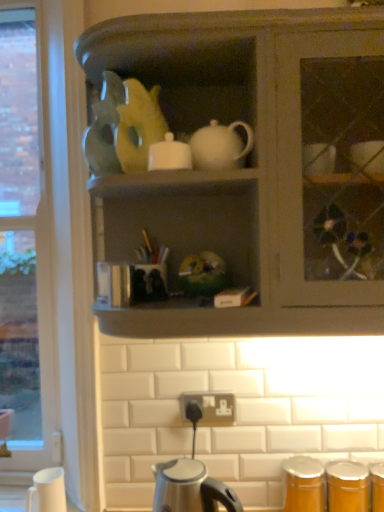
Question: Can you confirm if white glossy sugar bowl at upper center is thinner than satin silver kettle at lower center?

Choices:
 (A) no
 (B) yes

Answer: (B)

Question: From the image's perspective, does white glossy sugar bowl at upper center appear higher than satin silver kettle at lower center?

Choices:
 (A) yes
 (B) no

Answer: (A)

Question: Does white glossy sugar bowl at upper center have a greater height compared to satin silver kettle at lower center?

Choices:
 (A) yes
 (B) no

Answer: (B)

Question: Can you see white glossy sugar bowl at upper center touching satin silver kettle at lower center?

Choices:
 (A) yes
 (B) no

Answer: (B)

Question: Considering the relative positions of white glossy sugar bowl at upper center and satin silver kettle at lower center in the image provided, is white glossy sugar bowl at upper center to the right of satin silver kettle at lower center from the viewer's perspective?

Choices:
 (A) yes
 (B) no

Answer: (B)

Question: Is white glossy sugar bowl at upper center wider than satin silver kettle at lower center?

Choices:
 (A) no
 (B) yes

Answer: (A)

Question: Is satin silver kettle at lower center positioned beyond the bounds of matte orange canister at lower right?

Choices:
 (A) no
 (B) yes

Answer: (B)

Question: Does satin silver kettle at lower center come in front of matte orange canister at lower right?

Choices:
 (A) yes
 (B) no

Answer: (A)

Question: Considering the relative positions of satin silver kettle at lower center and matte orange canister at lower right in the image provided, is satin silver kettle at lower center to the right of matte orange canister at lower right from the viewer's perspective?

Choices:
 (A) yes
 (B) no

Answer: (B)

Question: Are satin silver kettle at lower center and matte orange canister at lower right making contact?

Choices:
 (A) yes
 (B) no

Answer: (B)

Question: Would you say satin silver kettle at lower center contains matte orange canister at lower right?

Choices:
 (A) no
 (B) yes

Answer: (A)

Question: From the image's perspective, is satin silver kettle at lower center on top of matte orange canister at lower right?

Choices:
 (A) yes
 (B) no

Answer: (A)

Question: Is matte gray cabinet at center at the back of satin silver kettle at lower center?

Choices:
 (A) no
 (B) yes

Answer: (A)